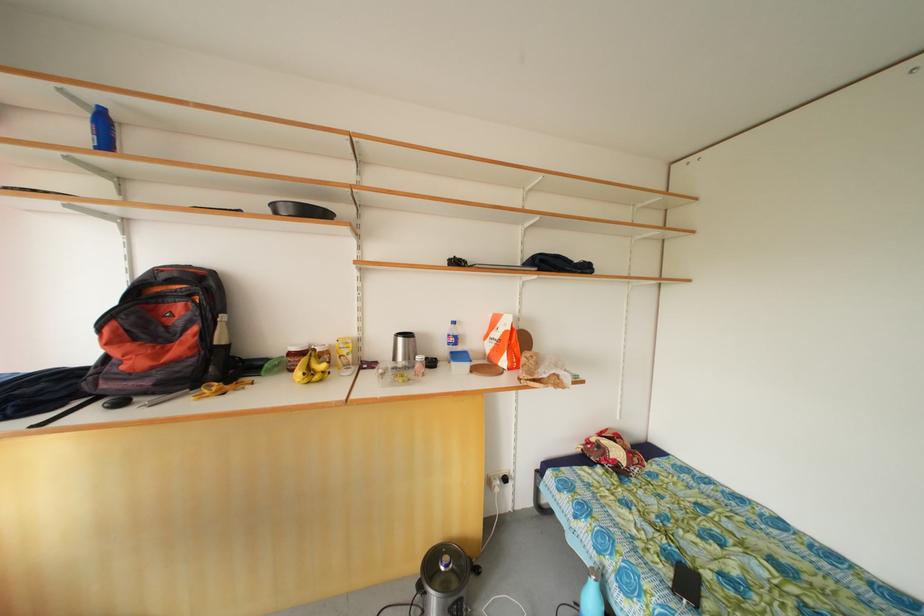
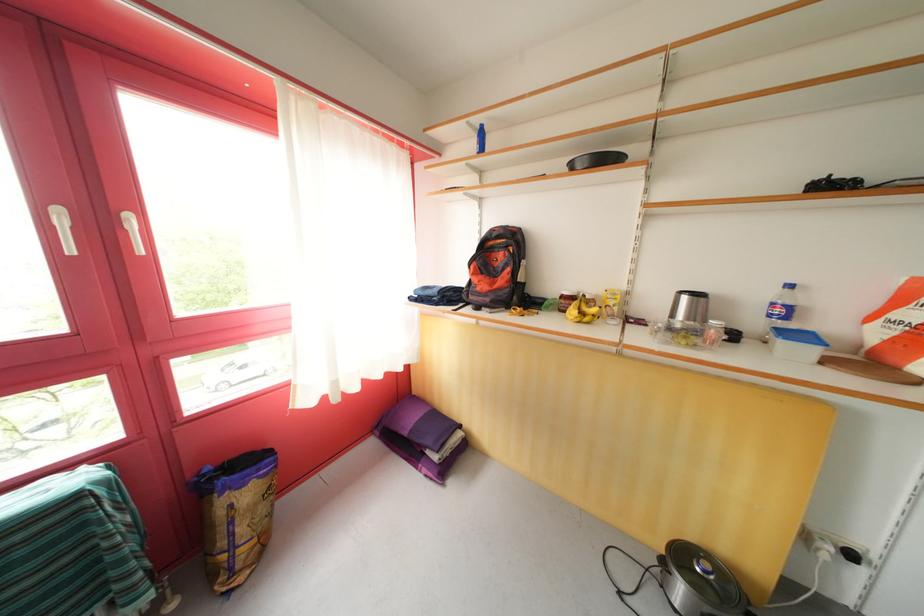
Question: The camera is either moving clockwise (left) or counter-clockwise (right) around the object. The first image is from the beginning of the video and the second image is from the end. Is the camera moving left or right when shooting the video?

Choices:
 (A) Left
 (B) Right

Answer: (B)